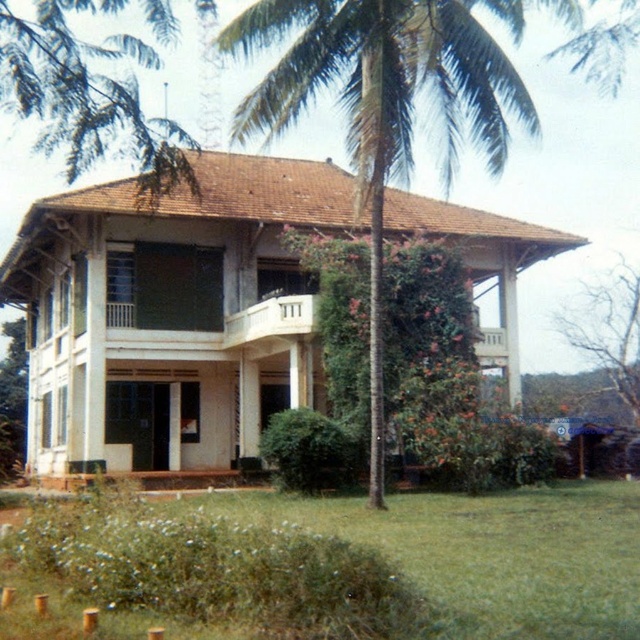
Question: Which of these objects is positioned closest to the green leafy palm tree at center?

Choices:
 (A) bare branches at upper right
 (B) green leafy tree at upper left
 (C) white painted wood gazebo at center

Answer: (C)

Question: Is the position of green grass at lower center less distant than that of green leafy tree at upper left?

Choices:
 (A) no
 (B) yes

Answer: (B)

Question: Which is farther from the white painted wood gazebo at center?

Choices:
 (A) bare branches at upper right
 (B) green leafy palm tree at center
 (C) green leafy tree at upper left
 (D) green grass at lower center

Answer: (A)

Question: Which is farther from the bare branches at upper right?

Choices:
 (A) green grass at lower center
 (B) white painted wood gazebo at center

Answer: (A)

Question: Does green grass at lower center have a larger size compared to green leafy tree at upper left?

Choices:
 (A) no
 (B) yes

Answer: (A)

Question: Is green leafy palm tree at center to the left of green grass at lower center from the viewer's perspective?

Choices:
 (A) yes
 (B) no

Answer: (B)